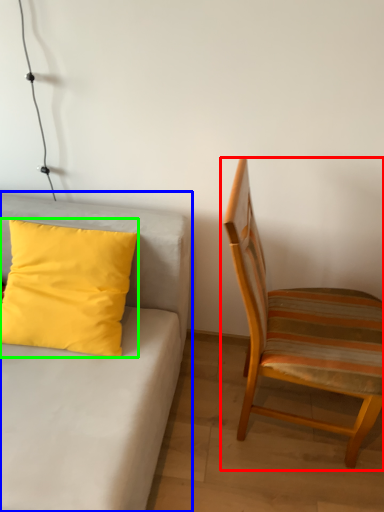
Question: Which object is positioned farthest from chair (highlighted by a red box)? Select from studio couch (highlighted by a blue box) and pillow (highlighted by a green box).

Choices:
 (A) studio couch
 (B) pillow

Answer: (B)